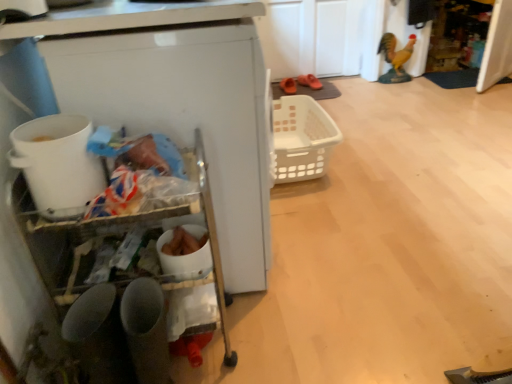
Question: Which direction should I rotate to face orange suede shoes at center, which is counted as the first footwear, starting from the left, — up or down?

Choices:
 (A) down
 (B) up

Answer: (B)

Question: Is the surface of white plastic bucket at left in direct contact with orange suede shoes at center, which ranks as the second footwear in right-to-left order?

Choices:
 (A) yes
 (B) no

Answer: (B)

Question: From a real-world perspective, is white plastic bucket at left under orange suede shoes at center, which ranks as the second footwear in right-to-left order?

Choices:
 (A) yes
 (B) no

Answer: (B)

Question: Is the depth of white plastic bucket at left greater than that of orange suede shoes at center, which is counted as the first footwear, starting from the left?

Choices:
 (A) no
 (B) yes

Answer: (A)

Question: From the image's perspective, does white plastic bucket at left appear higher than orange suede shoes at center, which ranks as the second footwear in right-to-left order?

Choices:
 (A) yes
 (B) no

Answer: (B)

Question: Does white plastic bucket at left have a lesser width compared to orange suede shoes at center, which is counted as the first footwear, starting from the left?

Choices:
 (A) no
 (B) yes

Answer: (B)

Question: Is white plastic bucket at left outside orange suede shoes at center, which is counted as the first footwear, starting from the left?

Choices:
 (A) yes
 (B) no

Answer: (A)

Question: Does orange suede shoes at center, which is counted as the first footwear, starting from the left, touch white plastic bucket at left?

Choices:
 (A) yes
 (B) no

Answer: (B)

Question: Does orange suede shoes at center, which ranks as the second footwear in right-to-left order, turn towards white plastic bucket at left?

Choices:
 (A) no
 (B) yes

Answer: (B)

Question: From the image's perspective, is orange suede shoes at center, which ranks as the second footwear in right-to-left order, on white plastic bucket at left?

Choices:
 (A) yes
 (B) no

Answer: (A)

Question: From a real-world perspective, is orange suede shoes at center, which ranks as the second footwear in right-to-left order, over white plastic bucket at left?

Choices:
 (A) no
 (B) yes

Answer: (A)

Question: Is orange suede shoes at center, which is counted as the first footwear, starting from the left, looking in the opposite direction of white plastic bucket at left?

Choices:
 (A) yes
 (B) no

Answer: (B)

Question: From a real-world perspective, is orange suede shoes at center, which is counted as the first footwear, starting from the left, below white plastic bucket at left?

Choices:
 (A) no
 (B) yes

Answer: (B)

Question: Is the depth of orange rubber clogs at center, which is the first footwear from right to left, greater than that of white plastic basket at center?

Choices:
 (A) no
 (B) yes

Answer: (B)